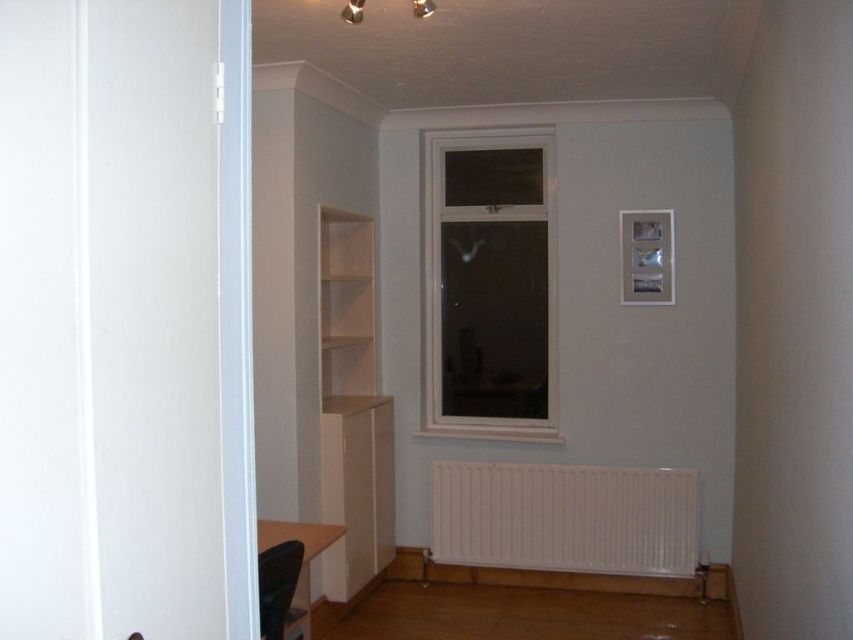
Question: Among these objects, which one is farthest from the camera?

Choices:
 (A) light wood shelf at upper center
 (B) white matte bookshelf at left
 (C) white plastic window at center
 (D) white matte radiator at lower center

Answer: (C)

Question: Is white plastic window at center above light wood shelf at upper center?

Choices:
 (A) yes
 (B) no

Answer: (A)

Question: Is white matte radiator at lower center smaller than light wood shelf at upper center?

Choices:
 (A) no
 (B) yes

Answer: (A)

Question: Which of the following is the closest to the observer?

Choices:
 (A) (347, 545)
 (B) (469, 387)

Answer: (A)

Question: Is white plastic window at center below light wood shelf at upper center?

Choices:
 (A) no
 (B) yes

Answer: (A)

Question: Which is nearer to the white matte bookshelf at left?

Choices:
 (A) white plastic window at center
 (B) light wood shelf at upper center

Answer: (B)